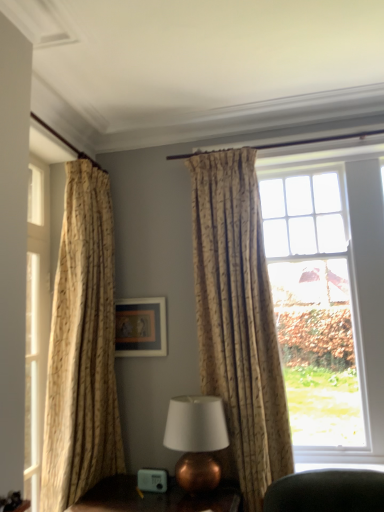
Question: Is beige textured curtain at left, the 2th curtain viewed from the right, next to copper metallic table lamp at center and touching it?

Choices:
 (A) yes
 (B) no

Answer: (B)

Question: From the image's perspective, is beige textured curtain at left, marked as the 1th curtain in a left-to-right arrangement, beneath copper metallic table lamp at center?

Choices:
 (A) no
 (B) yes

Answer: (A)

Question: Is beige textured curtain at left, the 2th curtain viewed from the right, closer to the viewer compared to copper metallic table lamp at center?

Choices:
 (A) yes
 (B) no

Answer: (A)

Question: Is beige textured curtain at left, marked as the 1th curtain in a left-to-right arrangement, bigger than copper metallic table lamp at center?

Choices:
 (A) no
 (B) yes

Answer: (B)

Question: Is copper metallic table lamp at center surrounded by beige textured curtain at left, the 2th curtain viewed from the right?

Choices:
 (A) no
 (B) yes

Answer: (A)

Question: Considering the positions of copper metallic table lamp at lower center and copper metallic table lamp at center in the image, is copper metallic table lamp at lower center bigger or smaller than copper metallic table lamp at center?

Choices:
 (A) big
 (B) small

Answer: (A)

Question: From a real-world perspective, is copper metallic table lamp at lower center above or below copper metallic table lamp at center?

Choices:
 (A) below
 (B) above

Answer: (A)

Question: In terms of width, does copper metallic table lamp at lower center look wider or thinner when compared to copper metallic table lamp at center?

Choices:
 (A) thin
 (B) wide

Answer: (B)

Question: Considering the positions of copper metallic table lamp at lower center and copper metallic table lamp at center in the image, is copper metallic table lamp at lower center taller or shorter than copper metallic table lamp at center?

Choices:
 (A) short
 (B) tall

Answer: (A)

Question: In terms of height, does copper metallic table lamp at center look taller or shorter compared to beige textured curtain at left, marked as the 1th curtain in a left-to-right arrangement?

Choices:
 (A) short
 (B) tall

Answer: (A)

Question: From a real-world perspective, relative to beige textured curtain at left, the 2th curtain viewed from the right, is copper metallic table lamp at center vertically above or below?

Choices:
 (A) above
 (B) below

Answer: (B)

Question: Is point (178, 442) positioned closer to the camera than point (92, 224)?

Choices:
 (A) farther
 (B) closer

Answer: (B)

Question: From the image's perspective, relative to beige textured curtain at left, the 2th curtain viewed from the right, is copper metallic table lamp at center above or below?

Choices:
 (A) below
 (B) above

Answer: (A)

Question: Considering the positions of copper metallic table lamp at lower center and clear glass window at upper right in the image, is copper metallic table lamp at lower center bigger or smaller than clear glass window at upper right?

Choices:
 (A) small
 (B) big

Answer: (A)

Question: From a real-world perspective, relative to clear glass window at upper right, is copper metallic table lamp at lower center vertically above or below?

Choices:
 (A) above
 (B) below

Answer: (B)